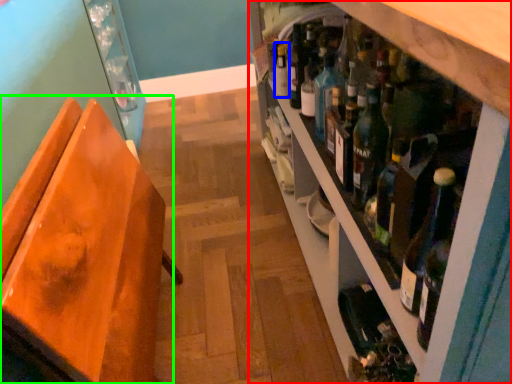
Question: Which object is the closest to the shelf (highlighted by a red box)? Choose among these: bottle (highlighted by a blue box) or chair (highlighted by a green box).

Choices:
 (A) bottle
 (B) chair

Answer: (A)